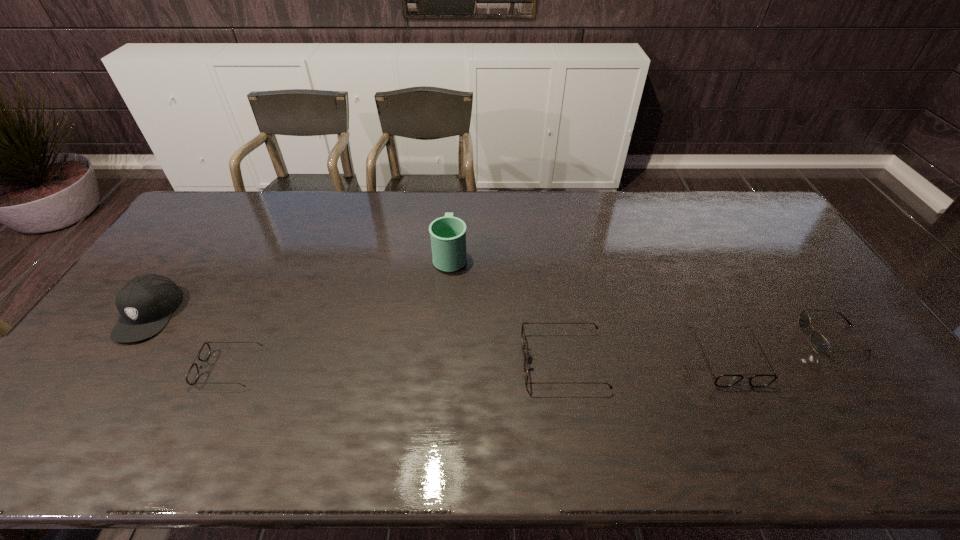
Locate an element on the screen. blank space located on the front-facing side of the rightmost object is located at coordinates (658, 338).

Locate an element on the screen. free space located 0.260m on the side of the tallest object with the handle is located at coordinates (454, 195).

Find the location of `free space located on the side of the tallest object with the handle`. free space located on the side of the tallest object with the handle is located at coordinates (455, 194).

This screenshot has height=540, width=960. I want to click on free space located 0.230m on the side of the tallest object with the handle, so click(x=454, y=200).

Where is `object at the left edge`? This screenshot has height=540, width=960. object at the left edge is located at coordinates (146, 302).

At what (x,y) coordinates should I click in order to perform the action: click on object that is at the right edge. Please return your answer as a coordinate pair (x, y). The image size is (960, 540). Looking at the image, I should click on (819, 343).

Where is `free space at the far edge of the desktop`? This screenshot has width=960, height=540. free space at the far edge of the desktop is located at coordinates (681, 192).

At what (x,y) coordinates should I click in order to perform the action: click on vacant area at the near edge. Please return your answer as a coordinate pair (x, y). The height and width of the screenshot is (540, 960). Looking at the image, I should click on (710, 407).

In the image, there is a desktop. Identify the location of blank space at the left edge. The width and height of the screenshot is (960, 540). (76, 374).

You are a GUI agent. You are given a task and a screenshot of the screen. Output one action in this format:
    pyautogui.click(x=<x>, y=<y>)
    Task: Click on the vacant area at the right edge of the desktop
    Image resolution: width=960 pixels, height=540 pixels.
    Given the screenshot: What is the action you would take?
    pyautogui.click(x=817, y=302)